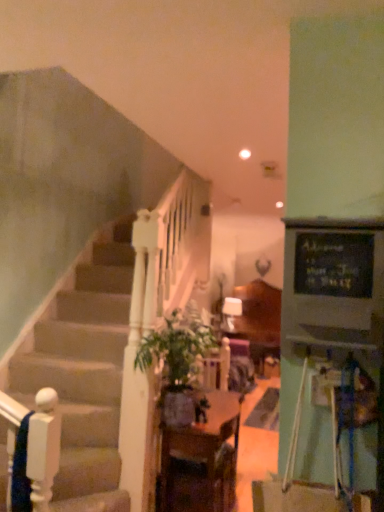
Question: Should I look upward or downward to see green leafy plant at center?

Choices:
 (A) down
 (B) up

Answer: (A)

Question: From a real-world perspective, does wooden table at center sit lower than green leafy plant at center?

Choices:
 (A) no
 (B) yes

Answer: (B)

Question: Can you confirm if wooden table at center is smaller than green leafy plant at center?

Choices:
 (A) no
 (B) yes

Answer: (A)

Question: Does wooden table at center appear on the left side of green leafy plant at center?

Choices:
 (A) yes
 (B) no

Answer: (B)

Question: Is wooden table at center outside green leafy plant at center?

Choices:
 (A) no
 (B) yes

Answer: (B)

Question: Are wooden table at center and green leafy plant at center making contact?

Choices:
 (A) yes
 (B) no

Answer: (B)

Question: Does wooden table at center have a greater height compared to green leafy plant at center?

Choices:
 (A) no
 (B) yes

Answer: (B)

Question: Could you tell me if green leafy plant at center is turned towards wooden table at center?

Choices:
 (A) no
 (B) yes

Answer: (A)

Question: Does green leafy plant at center come behind wooden table at center?

Choices:
 (A) no
 (B) yes

Answer: (A)

Question: From a real-world perspective, is green leafy plant at center positioned under wooden table at center based on gravity?

Choices:
 (A) no
 (B) yes

Answer: (A)

Question: Considering the relative sizes of green leafy plant at center and wooden table at center in the image provided, is green leafy plant at center bigger than wooden table at center?

Choices:
 (A) yes
 (B) no

Answer: (B)

Question: Can you confirm if green leafy plant at center is positioned to the left of wooden table at center?

Choices:
 (A) no
 (B) yes

Answer: (B)

Question: Considering the relative sizes of green leafy plant at center and wooden table at center in the image provided, is green leafy plant at center thinner than wooden table at center?

Choices:
 (A) yes
 (B) no

Answer: (B)

Question: Is green leafy plant at center taller or shorter than wooden table at center?

Choices:
 (A) short
 (B) tall

Answer: (A)